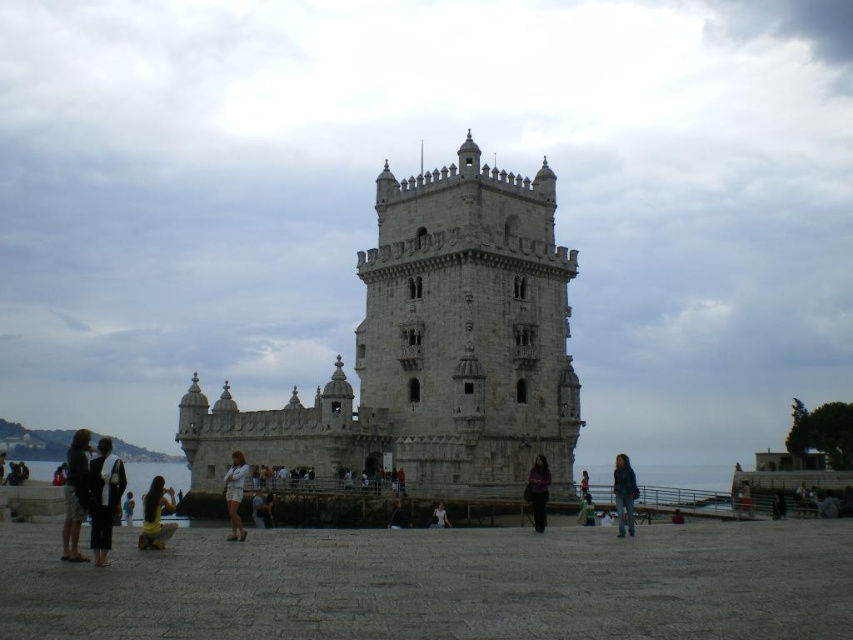
Is light brown leather jacket at lower right behind dark blue jeans at center?

Yes, light brown leather jacket at lower right is further from the viewer.

Does light brown leather jacket at lower right have a lesser width compared to dark blue jeans at center?

Indeed, light brown leather jacket at lower right has a lesser width compared to dark blue jeans at center.

You are a GUI agent. You are given a task and a screenshot of the screen. Output one action in this format:
    pyautogui.click(x=<x>, y=<y>)
    Task: Click on the light brown leather jacket at lower right
    This screenshot has height=640, width=853.
    Given the screenshot: What is the action you would take?
    pyautogui.click(x=744, y=499)

Looking at this image, which is more to the left, white cotton shorts at center or purple fabric at center?

Positioned to the left is white cotton shorts at center.

Does white cotton shorts at center have a larger size compared to purple fabric at center?

Yes.

Between point (236, 492) and point (535, 460), which one is positioned in front?

Point (236, 492) is more forward.

The image size is (853, 640). I want to click on white cotton shorts at center, so click(235, 493).

Between dark gray fabric pants at lower left and light brown hair at center, which one has less height?

With less height is light brown hair at center.

Image resolution: width=853 pixels, height=640 pixels. What are the coordinates of `dark gray fabric pants at lower left` in the screenshot? It's located at (103, 497).